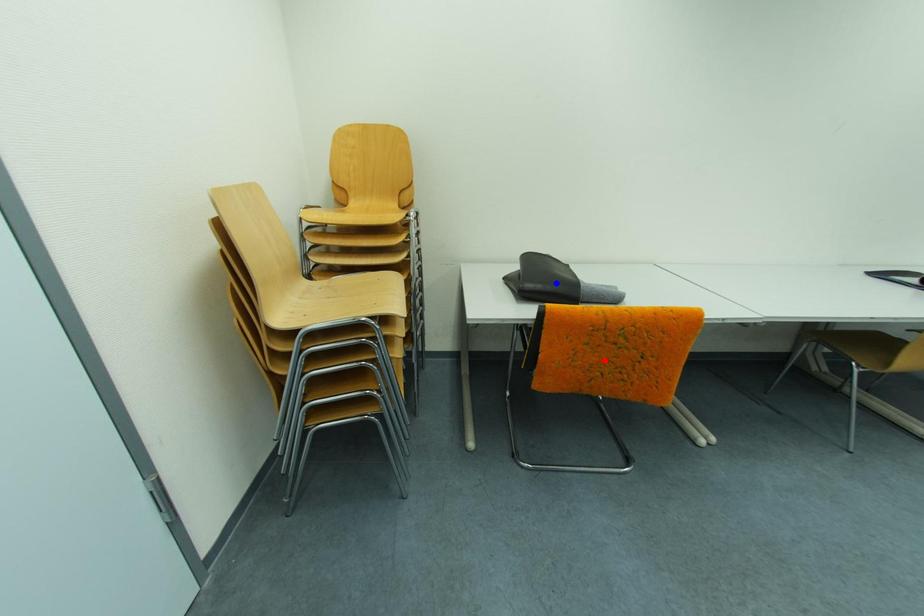
Question: Two points are marked on the image. Which point is closer to the camera?

Choices:
 (A) Blue point is closer.
 (B) Red point is closer.

Answer: (B)